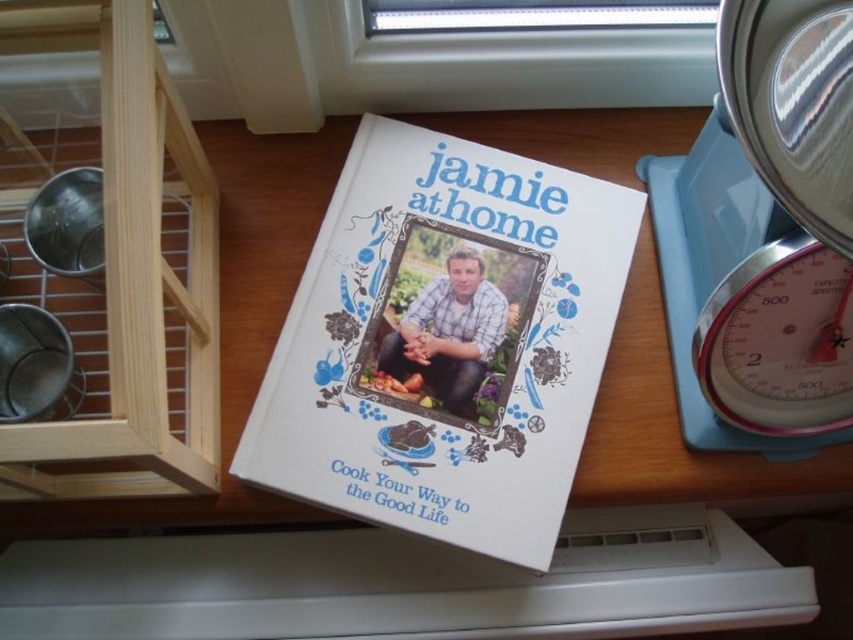
Question: Is white matte hardcover book at center wider than blue plastic scale at right?

Choices:
 (A) yes
 (B) no

Answer: (A)

Question: Does blue plastic scale at right appear under matte white book at center?

Choices:
 (A) yes
 (B) no

Answer: (B)

Question: Which object is the closest to the blue plastic scale at right?

Choices:
 (A) matte white book at center
 (B) white matte hardcover book at center
 (C) white plastic scale at right

Answer: (C)

Question: Is white matte hardcover book at center above white plastic scale at right?

Choices:
 (A) no
 (B) yes

Answer: (B)

Question: Among these points, which one is farthest from the camera?

Choices:
 (A) (751, 305)
 (B) (440, 365)

Answer: (B)

Question: Considering the real-world distances, which object is farthest from the white plastic scale at right?

Choices:
 (A) white matte hardcover book at center
 (B) matte white book at center

Answer: (B)